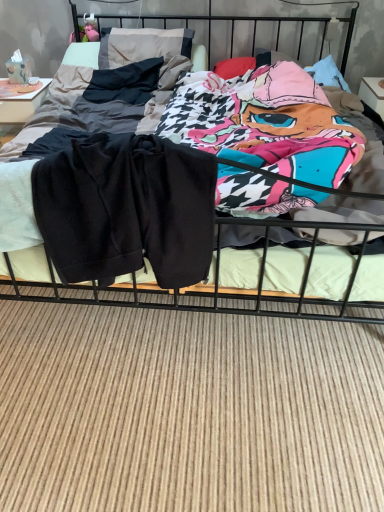
Question: Does dark gray fabric pillow at upper left contain black cotton shorts at center?

Choices:
 (A) no
 (B) yes

Answer: (A)

Question: Can you confirm if dark gray fabric pillow at upper left is shorter than black cotton shorts at center?

Choices:
 (A) yes
 (B) no

Answer: (A)

Question: Is dark gray fabric pillow at upper left positioned in front of black cotton shorts at center?

Choices:
 (A) yes
 (B) no

Answer: (B)

Question: Is dark gray fabric pillow at upper left thinner than black cotton shorts at center?

Choices:
 (A) no
 (B) yes

Answer: (B)

Question: Considering the relative positions of dark gray fabric pillow at upper left and black cotton shorts at center in the image provided, is dark gray fabric pillow at upper left to the left of black cotton shorts at center from the viewer's perspective?

Choices:
 (A) yes
 (B) no

Answer: (A)

Question: Looking at the image, does black cotton shorts at center seem bigger or smaller compared to black fleece shorts at center?

Choices:
 (A) big
 (B) small

Answer: (A)

Question: Does point (362, 41) appear closer or farther from the camera than point (198, 201)?

Choices:
 (A) farther
 (B) closer

Answer: (A)

Question: Considering their positions, is black cotton shorts at center located in front of or behind black fleece shorts at center?

Choices:
 (A) front
 (B) behind

Answer: (A)

Question: Considering the relative positions of black cotton shorts at center and black fleece shorts at center in the image provided, is black cotton shorts at center to the left or to the right of black fleece shorts at center?

Choices:
 (A) right
 (B) left

Answer: (A)

Question: Is black cotton shorts at center wider or thinner than dark gray fabric pillow at upper left?

Choices:
 (A) thin
 (B) wide

Answer: (B)

Question: From the image's perspective, relative to dark gray fabric pillow at upper left, is black cotton shorts at center above or below?

Choices:
 (A) above
 (B) below

Answer: (B)

Question: Choose the correct answer: Is black cotton shorts at center inside dark gray fabric pillow at upper left or outside it?

Choices:
 (A) inside
 (B) outside

Answer: (B)

Question: In terms of height, does black cotton shorts at center look taller or shorter compared to dark gray fabric pillow at upper left?

Choices:
 (A) short
 (B) tall

Answer: (B)

Question: In terms of height, does dark gray fabric pillow at upper left look taller or shorter compared to black cotton shorts at center?

Choices:
 (A) short
 (B) tall

Answer: (A)

Question: Is dark gray fabric pillow at upper left in front of or behind black cotton shorts at center in the image?

Choices:
 (A) behind
 (B) front

Answer: (A)